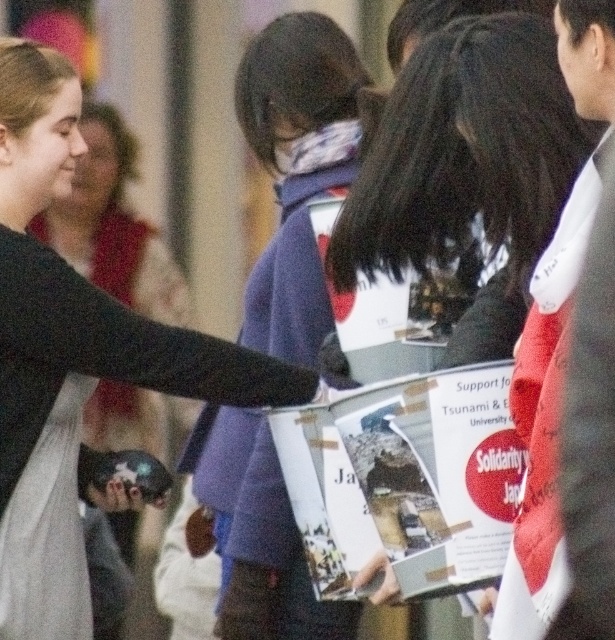
Between white paper flyer at center and matte black sweater at left, which one is positioned higher?

matte black sweater at left is higher up.

Describe the element at coordinates (467, 168) in the screenshot. I see `white paper flyer at center` at that location.

Identify the location of white paper flyer at center. (467, 168).

Based on the photo, does purple fleece jacket at center have a lesser height compared to matte black sweater at left?

Yes, purple fleece jacket at center is shorter than matte black sweater at left.

Between purple fleece jacket at center and matte black sweater at left, which one has less height?

Standing shorter between the two is purple fleece jacket at center.

Measure the distance between point (330, 147) and camera.

Point (330, 147) and camera are 4.66 meters apart.

This screenshot has height=640, width=615. In order to click on purple fleece jacket at center in this screenshot , I will do `click(300, 168)`.

The image size is (615, 640). What do you see at coordinates (74, 358) in the screenshot?
I see `matte black jacket at center` at bounding box center [74, 358].

Between matte black jacket at center and matte black hand at center, which one appears on the left side from the viewer's perspective?

matte black jacket at center

Is point (44, 630) closer to camera compared to point (381, 595)?

No, it is not.

Image resolution: width=615 pixels, height=640 pixels. Find the location of `matte black jacket at center`. matte black jacket at center is located at coordinates (74, 358).